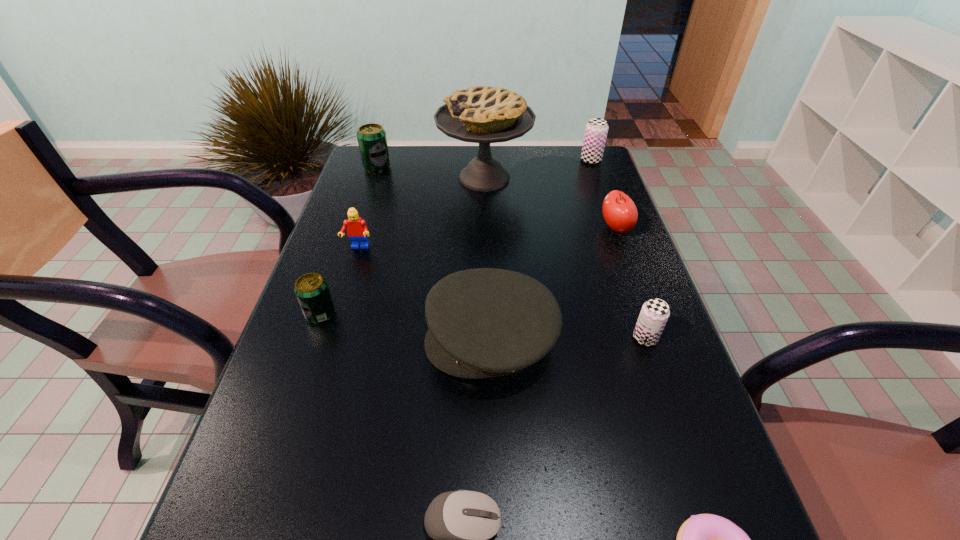
Where is `the tallest object`? the tallest object is located at coordinates (484, 115).

At what (x,y) coordinates should I click in order to perform the action: click on the bigger purple beer can. Please return your answer as a coordinate pair (x, y). The width and height of the screenshot is (960, 540). Looking at the image, I should click on (596, 130).

Find the location of a particular element. the farther green beer can is located at coordinates (372, 140).

The image size is (960, 540). Find the location of `gray beret`. gray beret is located at coordinates (486, 322).

Image resolution: width=960 pixels, height=540 pixels. What are the coordinates of `the fourth farthest object` in the screenshot? It's located at (619, 211).

Image resolution: width=960 pixels, height=540 pixels. I want to click on red Lego, so click(x=357, y=230).

Where is `Lego`? The image size is (960, 540). Lego is located at coordinates (357, 230).

Find the location of a particular element. The height and width of the screenshot is (540, 960). the smaller purple beer can is located at coordinates (654, 314).

The height and width of the screenshot is (540, 960). I want to click on the nearest beer can, so 654,314.

This screenshot has width=960, height=540. In order to click on the second nearest beer can in this screenshot , I will do `click(311, 289)`.